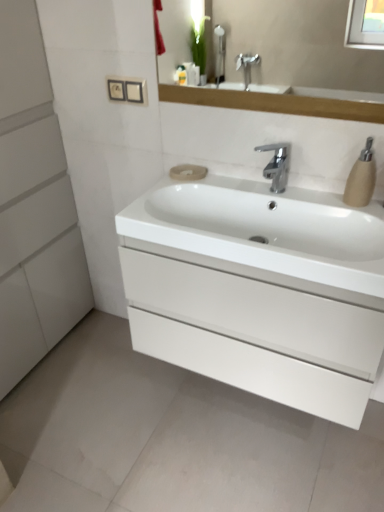
The height and width of the screenshot is (512, 384). Find the location of `vacant area that lies between polished chrome faucet at center and beige matte soap at center`. vacant area that lies between polished chrome faucet at center and beige matte soap at center is located at coordinates (228, 179).